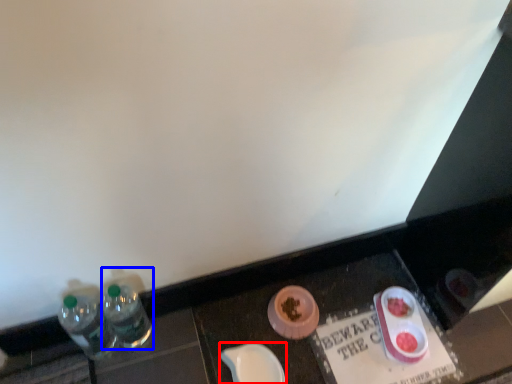
Question: Which point is closer to the camera, tableware (highlighted by a red box) or bottle (highlighted by a blue box)?

Choices:
 (A) tableware
 (B) bottle

Answer: (B)